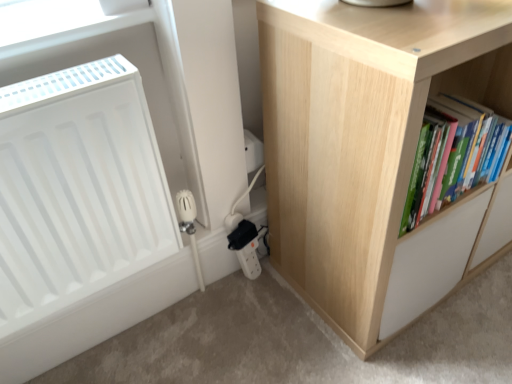
Question: Is the depth of green matte book at right greater than that of white matte radiator at left?

Choices:
 (A) yes
 (B) no

Answer: (A)

Question: Does green matte book at right have a smaller size compared to white matte radiator at left?

Choices:
 (A) no
 (B) yes

Answer: (B)

Question: From a real-world perspective, is green matte book at right located beneath white matte radiator at left?

Choices:
 (A) yes
 (B) no

Answer: (B)

Question: Is green matte book at right in contact with white matte radiator at left?

Choices:
 (A) yes
 (B) no

Answer: (B)

Question: Is green matte book at right to the right of white matte radiator at left from the viewer's perspective?

Choices:
 (A) yes
 (B) no

Answer: (A)

Question: Is white matte radiator at left bigger or smaller than green matte book at right?

Choices:
 (A) small
 (B) big

Answer: (B)

Question: Is point 117,137 closer or farther from the camera than point 443,201?

Choices:
 (A) closer
 (B) farther

Answer: (A)

Question: In the image, is white matte radiator at left on the left side or the right side of green matte book at right?

Choices:
 (A) right
 (B) left

Answer: (B)

Question: From the image's perspective, is white matte radiator at left above or below green matte book at right?

Choices:
 (A) below
 (B) above

Answer: (A)

Question: In terms of height, does green matte book at right look taller or shorter compared to white matte radiator at left?

Choices:
 (A) tall
 (B) short

Answer: (B)

Question: Relative to white matte radiator at left, is green matte book at right in front or behind?

Choices:
 (A) front
 (B) behind

Answer: (B)

Question: Considering the positions of green matte book at right and white matte radiator at left in the image, is green matte book at right bigger or smaller than white matte radiator at left?

Choices:
 (A) small
 (B) big

Answer: (A)

Question: From the image's perspective, is green matte book at right located above or below white matte radiator at left?

Choices:
 (A) above
 (B) below

Answer: (A)

Question: Is natural wood cupboard at right taller or shorter than green matte book at right?

Choices:
 (A) tall
 (B) short

Answer: (A)

Question: Looking at the image, does natural wood cupboard at right seem bigger or smaller compared to green matte book at right?

Choices:
 (A) small
 (B) big

Answer: (B)